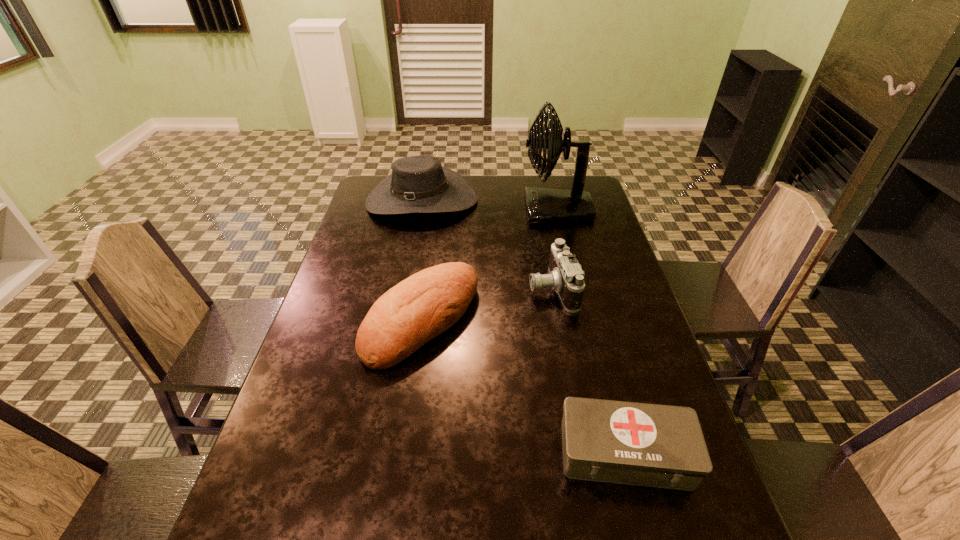
Identify the location of free spot that satisfies the following two spatial constraints: 1. on the front-facing side of the bread; 2. on the left side of the cowboy hat. tap(399, 320).

Find the location of a particular element. This screenshot has height=540, width=960. free spot that satisfies the following two spatial constraints: 1. on the front-facing side of the second tallest object; 2. on the left side of the bread is located at coordinates (399, 320).

Locate an element on the screen. free space that satisfies the following two spatial constraints: 1. on the front-facing side of the nearest object; 2. on the right side of the fourth shortest object is located at coordinates (374, 453).

At what (x,y) coordinates should I click in order to perform the action: click on free space that satisfies the following two spatial constraints: 1. on the front-facing side of the fourth shortest object; 2. on the right side of the bread. Please return your answer as a coordinate pair (x, y). Looking at the image, I should click on (399, 320).

Identify the location of free spot that satisfies the following two spatial constraints: 1. on the back side of the nearest object; 2. in front of the fan to blow air. This screenshot has width=960, height=540. (563, 210).